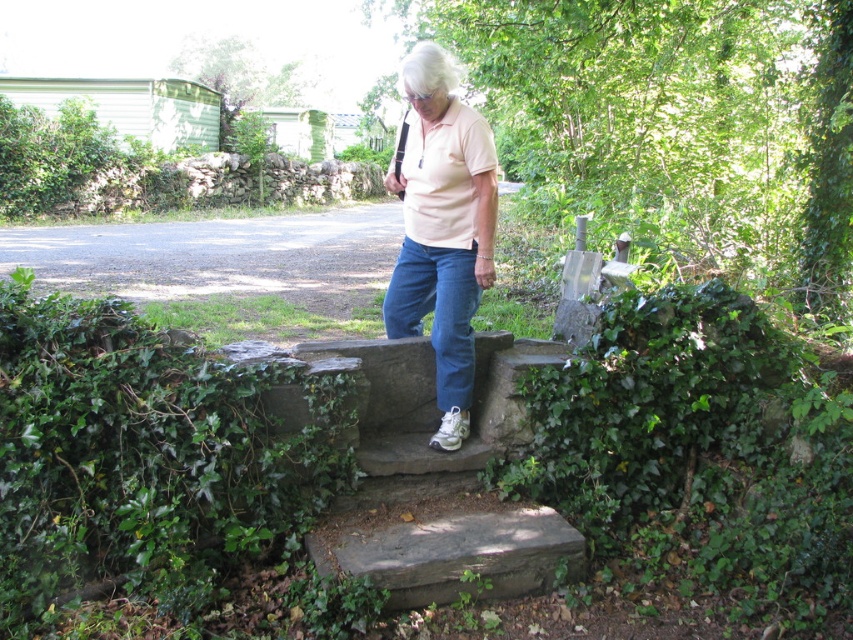
Describe the element at coordinates (440, 481) in the screenshot. I see `stone steps at center` at that location.

Which of these two, stone steps at center or pink cotton shirt at center, stands taller?

Standing taller between the two is pink cotton shirt at center.

Does point (403, 362) come in front of point (457, 241)?

No, it is not.

At what (x,y) coordinates should I click in order to perform the action: click on stone steps at center. Please return your answer as a coordinate pair (x, y). Looking at the image, I should click on (440, 481).